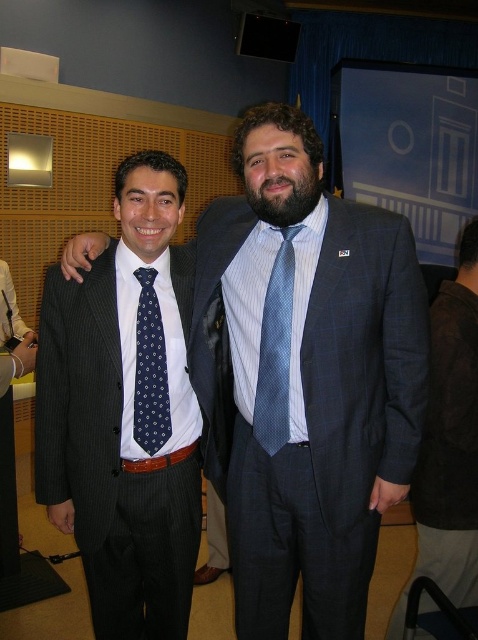
You are a photographer setting up for a formal event. You need to position a spotlight so that it illuminates both the blue textured suit at center and the navy dotted tie at center without casting shadows on the background. Given their positions, which object should you place the spotlight closer to?

The blue textured suit at center is below the navy dotted tie at center, so the spotlight should be placed closer to the navy dotted tie at center to avoid casting shadows on the background.

You are a photographer setting up for a formal portrait. You want to ensure that the blue textured suit at center and the navy dotted tie at center are clearly visible in the frame. Given their current distance apart, is the spacing between them sufficient to avoid blurring either item when focusing on one?

The blue textured suit at center is 12.77 inches from the navy dotted tie at center. This distance may cause one of them to be out of focus if the camera is focused on the other, so adjusting the focus or camera settings might be necessary to ensure both are clear.

You are a photographer setting up for a formal event. You need to ensure that the blue textured suit at right and the blue dotted tie at center are both visible in the frame. Based on their positions and sizes, which object should you prioritize focusing on to ensure it doesn

The blue textured suit at right is wider than the blue dotted tie at center, so you should prioritize focusing on the blue textured suit at right to ensure it is fully captured in the frame.